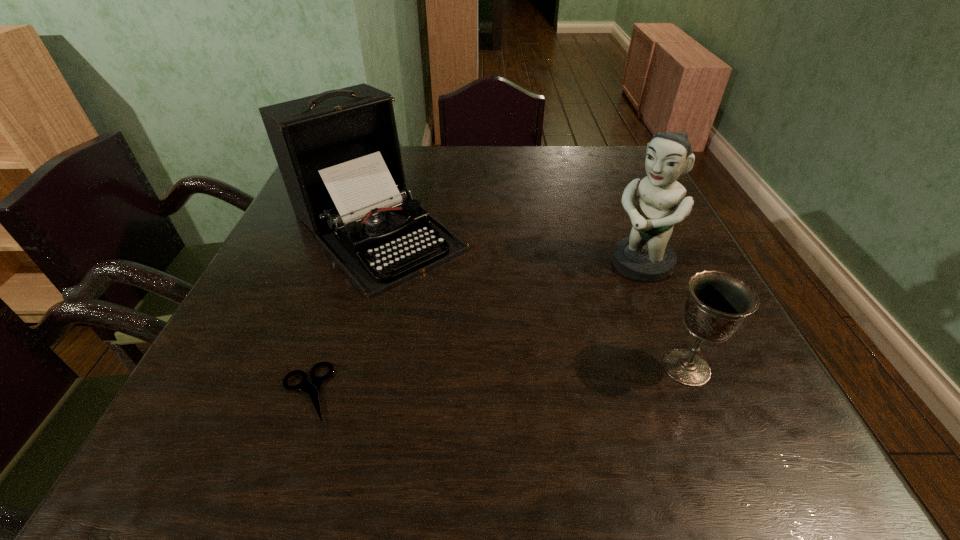
Identify the location of vacant space situated 0.100m on the front-facing side of the figurine. Image resolution: width=960 pixels, height=540 pixels. pyautogui.click(x=594, y=301).

This screenshot has width=960, height=540. Identify the location of free space located on the front-facing side of the figurine. (594, 301).

At what (x,y) coordinates should I click in order to perform the action: click on object at the far edge. Please return your answer as a coordinate pair (x, y). The image size is (960, 540). Looking at the image, I should click on (338, 152).

Image resolution: width=960 pixels, height=540 pixels. What are the coordinates of `shears that is at the near edge` in the screenshot? It's located at (312, 389).

Identify the location of chalice that is at the near edge. (717, 305).

The width and height of the screenshot is (960, 540). Find the location of `shears situated at the left edge`. shears situated at the left edge is located at coordinates (312, 389).

Locate an element on the screen. typewriter located at the left edge is located at coordinates (338, 152).

The width and height of the screenshot is (960, 540). In order to click on chalice at the right edge in this screenshot , I will do `click(717, 305)`.

Where is `figurine located at the right edge`? This screenshot has width=960, height=540. figurine located at the right edge is located at coordinates (645, 255).

Locate an element on the screen. object present at the far left corner is located at coordinates (338, 152).